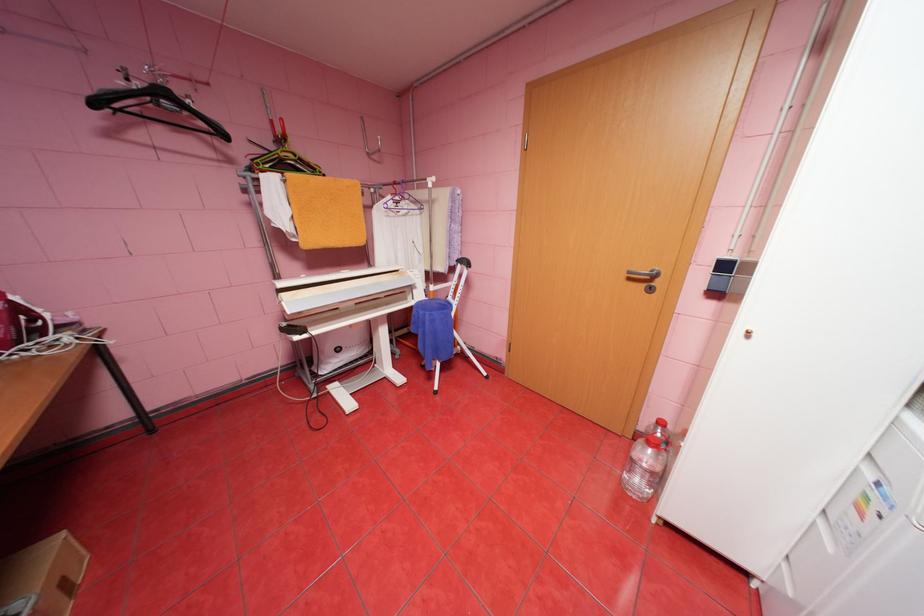
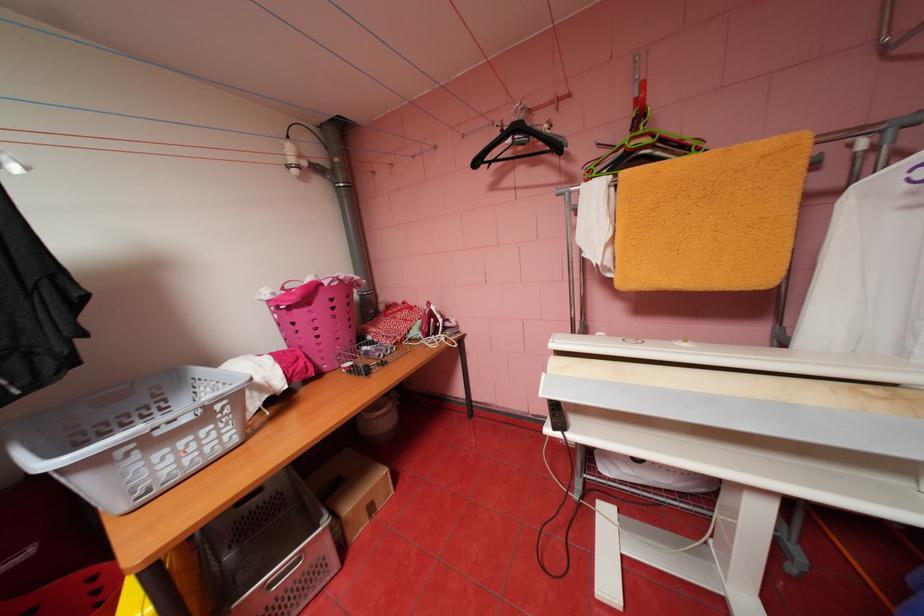
Locate, in the second image, the point that corresponds to the point at 300,156 in the first image.

(655, 140)